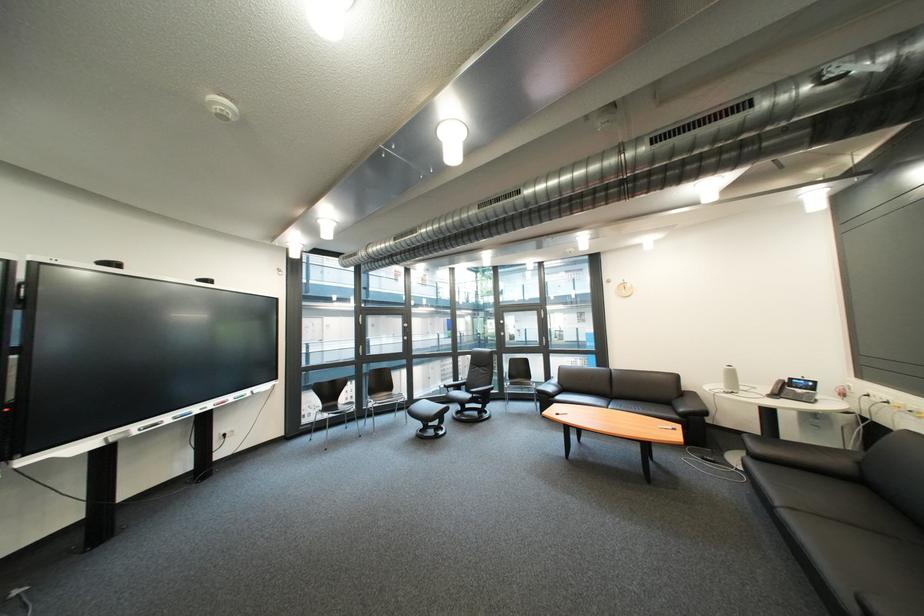
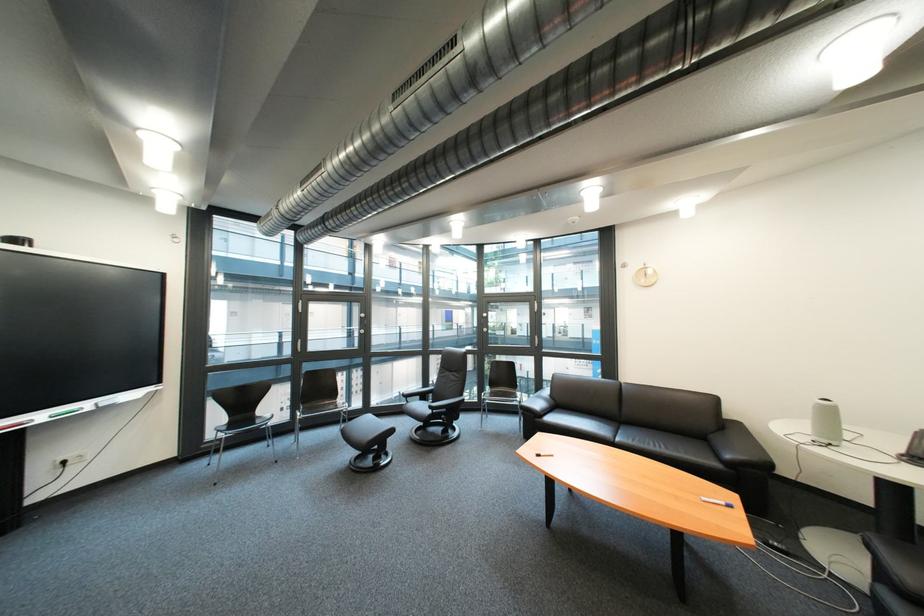
Find the pixel in the second image that matches (261,394) in the first image.

(101, 406)